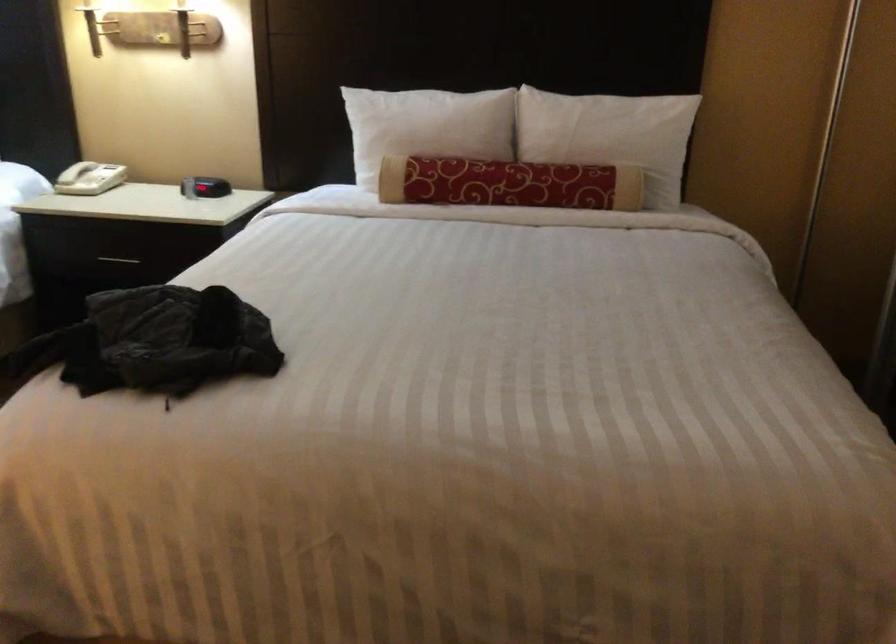
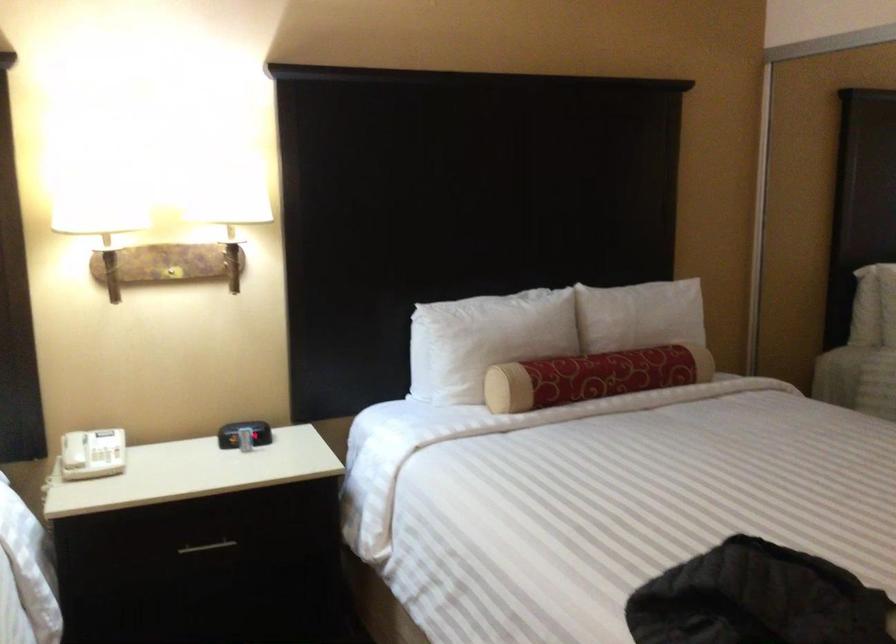
Find the pixel in the second image that matches pixel 116 254 in the first image.

(207, 547)